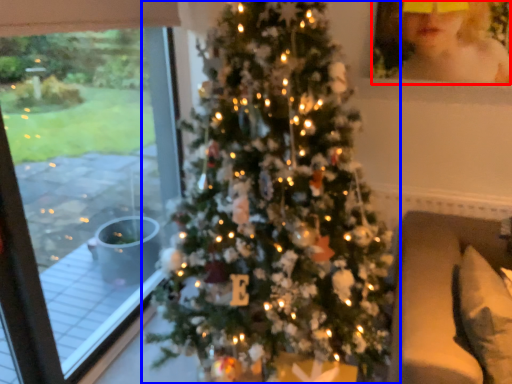
Question: Which object appears closest to the camera in this image, toddler (highlighted by a red box) or christmas tree (highlighted by a blue box)?

Choices:
 (A) toddler
 (B) christmas tree

Answer: (B)